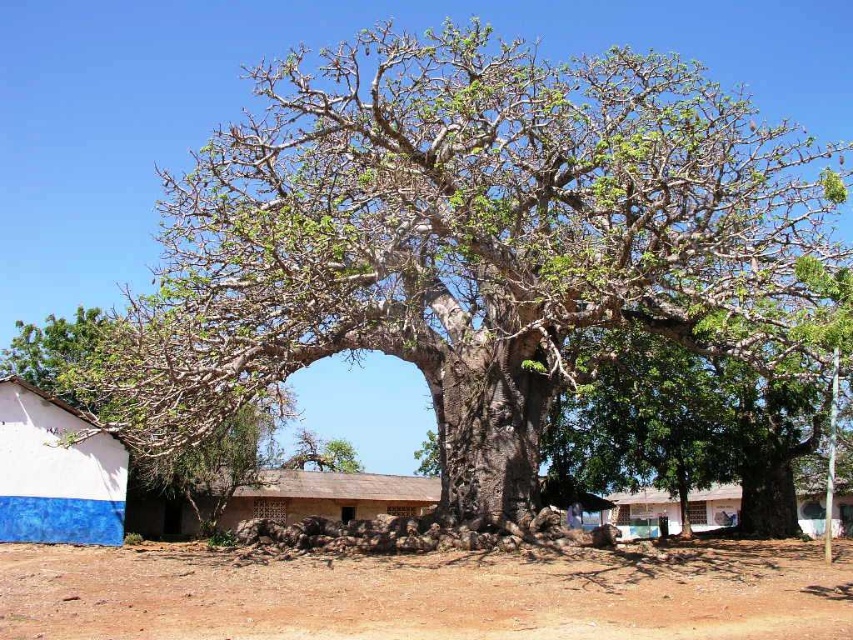
You are standing at the edge of the scene and want to reach the white painted wood hut at center. However, there is a white painted wall at lower left in your path. Based on the scene description, can you walk around the wall to access the hut?

The white painted wall at lower left is in front of the white painted wood hut at center, so you cannot walk around the wall to access the hut because the wall is blocking the direct path to the hut.

You are standing in the rural area and see the brown dirt field at lower center and the white painted wood hut at center. Which object is positioned to the left of the other?

The brown dirt field at lower center is to the left of the white painted wood hut at center.

You are standing in the rural area and want to walk from the brown dirt field at lower center to the green rough bark tree at center. Which direction should you move towards?

You should move towards the right because the brown dirt field at lower center is to the left of the green rough bark tree at center, so moving right will take you towards the tree.